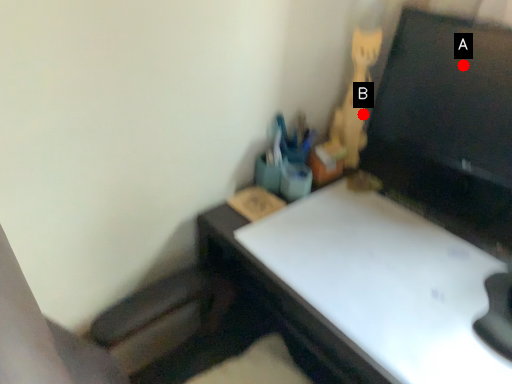
Question: Two points are circled on the image, labeled by A and B beside each circle. Which of the following is the farthest from the observer?

Choices:
 (A) A is further
 (B) B is further

Answer: (B)